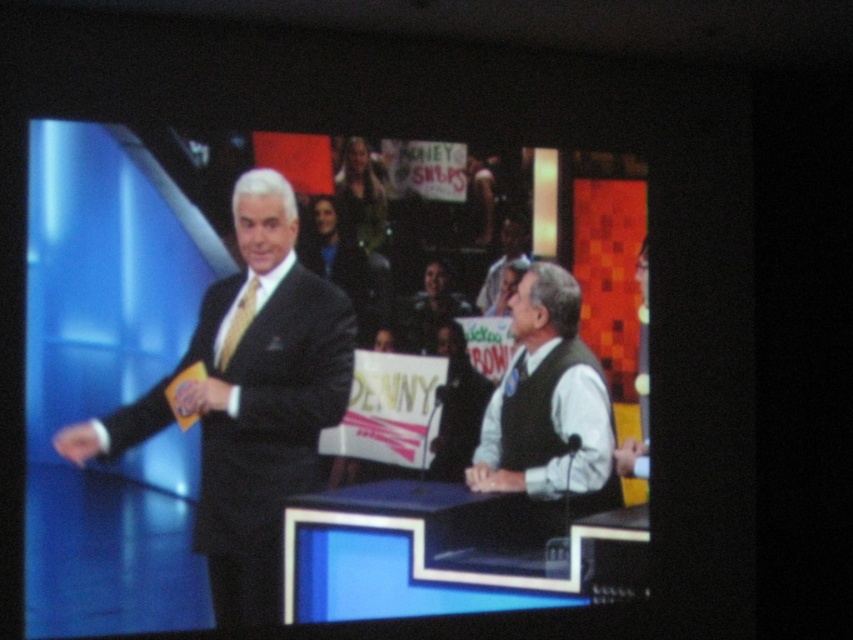
Question: Can you confirm if shiny black suit at left is positioned below white matte vest at center?

Choices:
 (A) no
 (B) yes

Answer: (A)

Question: Which point appears closest to the camera in this image?

Choices:
 (A) (550, 426)
 (B) (223, 326)

Answer: (B)

Question: Can you confirm if shiny black suit at left is thinner than white matte vest at center?

Choices:
 (A) no
 (B) yes

Answer: (A)

Question: Is shiny black suit at left wider than white matte vest at center?

Choices:
 (A) yes
 (B) no

Answer: (A)